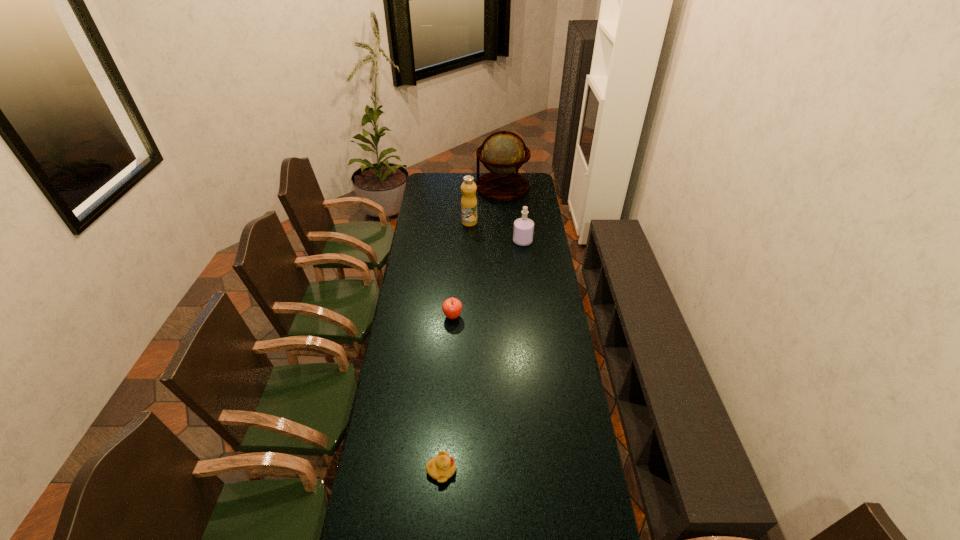
Locate an element on the screen. the closest object to the duckling is located at coordinates (452, 307).

Where is `free space that satisfies the following two spatial constraints: 1. on the front side of the third tallest object; 2. at the beak of the shortest object`? free space that satisfies the following two spatial constraints: 1. on the front side of the third tallest object; 2. at the beak of the shortest object is located at coordinates (550, 470).